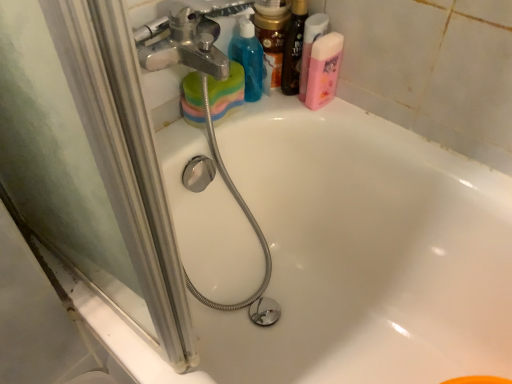
The image size is (512, 384). I want to click on free spot to the left of pink matte shaving cream at upper right, so click(257, 105).